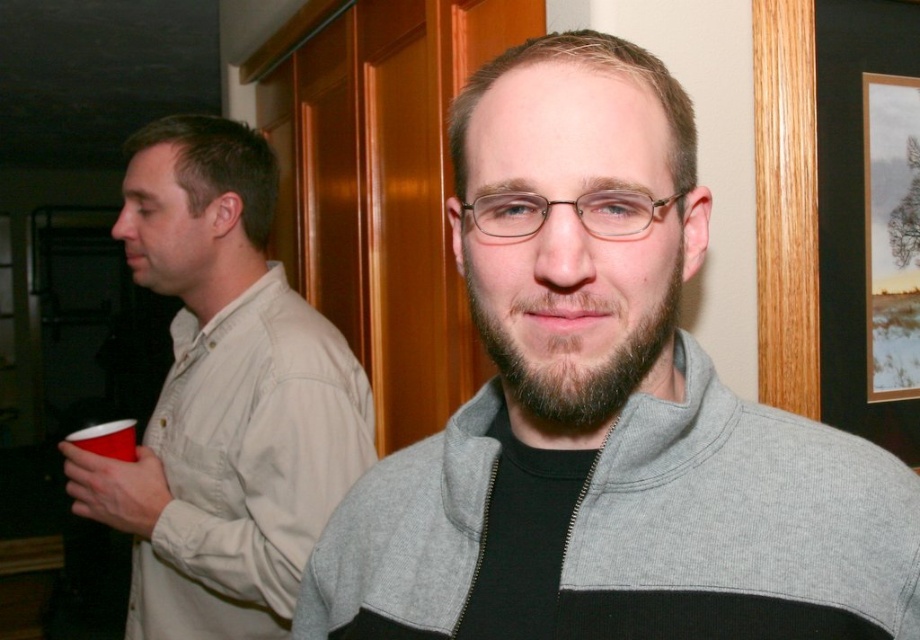
Question: Which point is farther from the camera taking this photo?

Choices:
 (A) (79, 432)
 (B) (742, 458)

Answer: (A)

Question: Estimate the real-world distances between objects in this image. Which object is closer to the brown fuzzy beard at center?

Choices:
 (A) red plastic cup at lower left
 (B) wooden picture frame at right
 (C) beige shirt at left
 (D) gray zip-up sweater at center

Answer: (D)

Question: Can you confirm if brown fuzzy beard at center is positioned to the left of red plastic cup at lower left?

Choices:
 (A) yes
 (B) no

Answer: (B)

Question: Can you confirm if wooden picture frame at right is smaller than red plastic cup at lower left?

Choices:
 (A) yes
 (B) no

Answer: (B)

Question: Which object is positioned closest to the red plastic cup at lower left?

Choices:
 (A) beige shirt at left
 (B) gray zip-up sweater at center
 (C) wooden picture frame at right
 (D) brown fuzzy beard at center

Answer: (A)

Question: Is beige shirt at left below wooden picture frame at right?

Choices:
 (A) yes
 (B) no

Answer: (A)